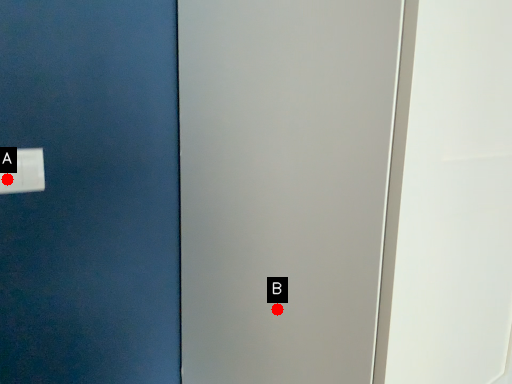
Question: Two points are circled on the image, labeled by A and B beside each circle. Which point is further to the camera?

Choices:
 (A) A is further
 (B) B is further

Answer: (A)